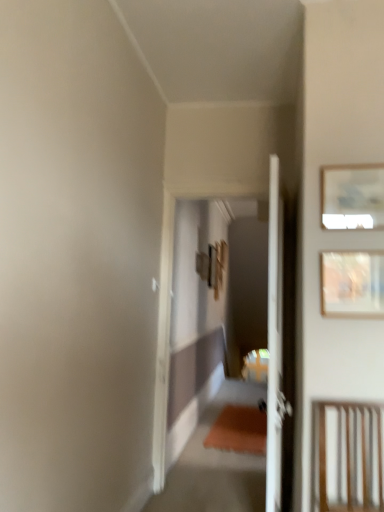
Question: Can you confirm if wooden framed artwork at upper right, which ranks as the second picture frame in top-to-bottom order, is thinner than matte white picture frame at upper right, the second picture frame when ordered from bottom to top?

Choices:
 (A) yes
 (B) no

Answer: (B)

Question: Is matte white picture frame at upper right, which is the first picture frame in top-to-bottom order, at the back of wooden framed artwork at upper right, the 1th picture frame positioned from the bottom?

Choices:
 (A) yes
 (B) no

Answer: (B)

Question: From a real-world perspective, is wooden framed artwork at upper right, the 1th picture frame positioned from the bottom, physically above matte white picture frame at upper right, the second picture frame when ordered from bottom to top?

Choices:
 (A) yes
 (B) no

Answer: (B)

Question: Is wooden framed artwork at upper right, which ranks as the second picture frame in top-to-bottom order, smaller than matte white picture frame at upper right, the second picture frame when ordered from bottom to top?

Choices:
 (A) yes
 (B) no

Answer: (B)

Question: Is wooden framed artwork at upper right, which ranks as the second picture frame in top-to-bottom order, completely or partially outside of matte white picture frame at upper right, the second picture frame when ordered from bottom to top?

Choices:
 (A) yes
 (B) no

Answer: (A)

Question: Considering the positions of point (337, 456) and point (349, 295), is point (337, 456) closer or farther from the camera than point (349, 295)?

Choices:
 (A) farther
 (B) closer

Answer: (B)

Question: From the image's perspective, is wooden slats at lower right positioned above or below wooden framed artwork at upper right, the 1th picture frame positioned from the bottom?

Choices:
 (A) below
 (B) above

Answer: (A)

Question: Considering the relative positions of wooden slats at lower right and wooden framed artwork at upper right, the 1th picture frame positioned from the bottom, in the image provided, is wooden slats at lower right to the left or to the right of wooden framed artwork at upper right, the 1th picture frame positioned from the bottom,?

Choices:
 (A) right
 (B) left

Answer: (B)

Question: Looking at their shapes, would you say wooden slats at lower right is wider or thinner than wooden framed artwork at upper right, the 1th picture frame positioned from the bottom?

Choices:
 (A) wide
 (B) thin

Answer: (A)

Question: Based on their positions, is wooden slats at lower right located to the left or right of matte white picture frame at upper right, the second picture frame when ordered from bottom to top?

Choices:
 (A) right
 (B) left

Answer: (B)

Question: Does point (319, 465) appear closer or farther from the camera than point (362, 218)?

Choices:
 (A) closer
 (B) farther

Answer: (A)

Question: Is wooden slats at lower right spatially inside matte white picture frame at upper right, which is the first picture frame in top-to-bottom order, or outside of it?

Choices:
 (A) outside
 (B) inside

Answer: (A)

Question: Is wooden slats at lower right taller or shorter than matte white picture frame at upper right, the second picture frame when ordered from bottom to top?

Choices:
 (A) short
 (B) tall

Answer: (B)

Question: Looking at the image, does wooden framed artwork at upper right, the 1th picture frame positioned from the bottom, seem bigger or smaller compared to matte white picture frame at upper right, the second picture frame when ordered from bottom to top?

Choices:
 (A) big
 (B) small

Answer: (A)

Question: From their relative heights in the image, would you say wooden framed artwork at upper right, which ranks as the second picture frame in top-to-bottom order, is taller or shorter than matte white picture frame at upper right, which is the first picture frame in top-to-bottom order?

Choices:
 (A) tall
 (B) short

Answer: (A)